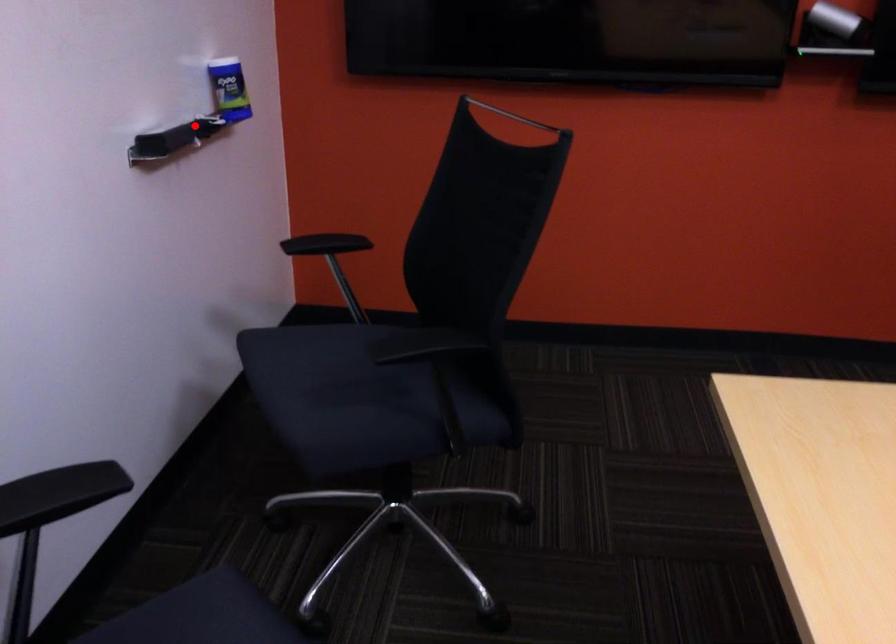
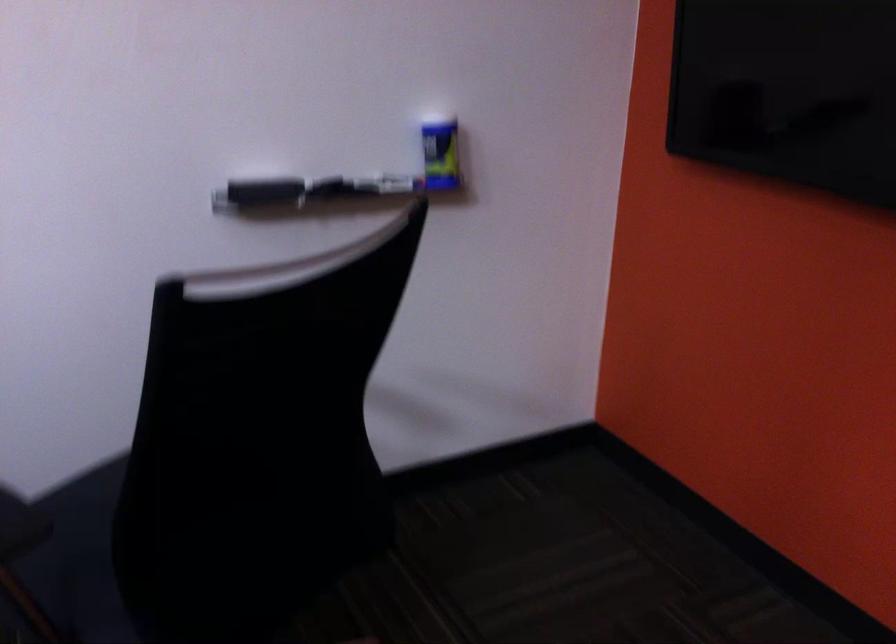
Question: A red point is marked in image1. In image2, is the corresponding 3D point closer to the camera or farther? Reply with the corresponding letter.

Choices:
 (A) The corresponding 3D point is closer.
 (B) The corresponding 3D point is farther.

Answer: (A)